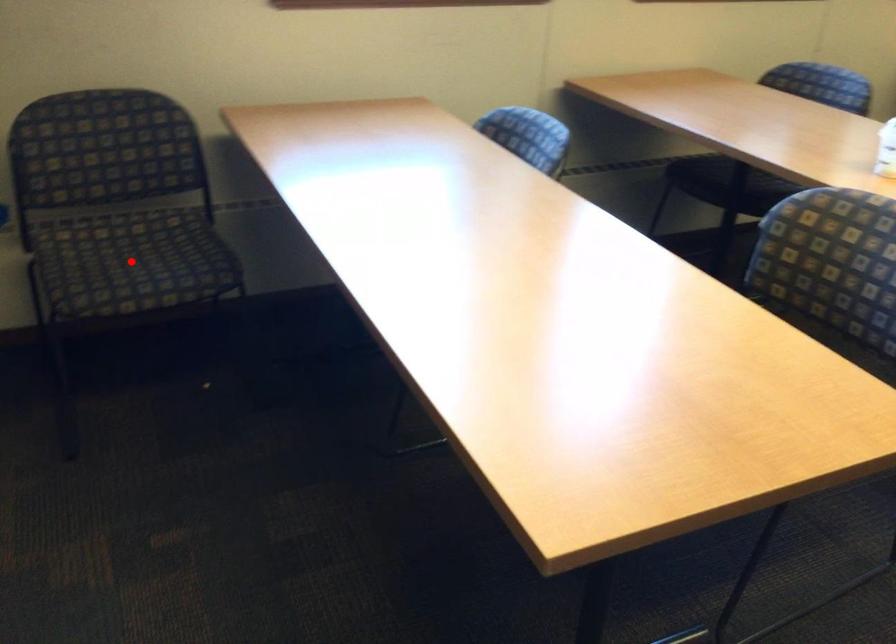
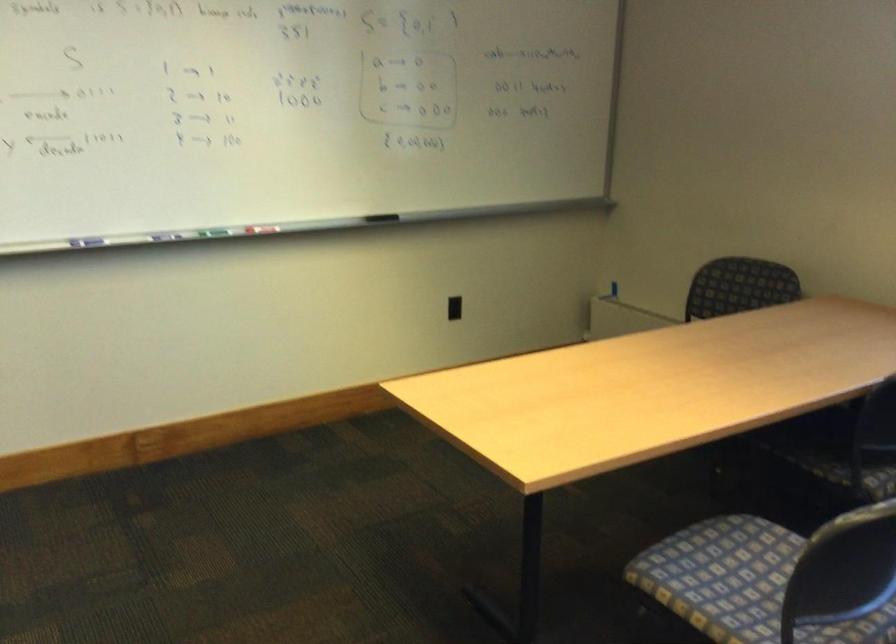
Question: I am providing you with two images of the same scene from different viewpoints. A red point is marked on the first image. At the location where the point appears in image 1, is it still visible in image 2?

Choices:
 (A) Yes
 (B) No

Answer: (B)